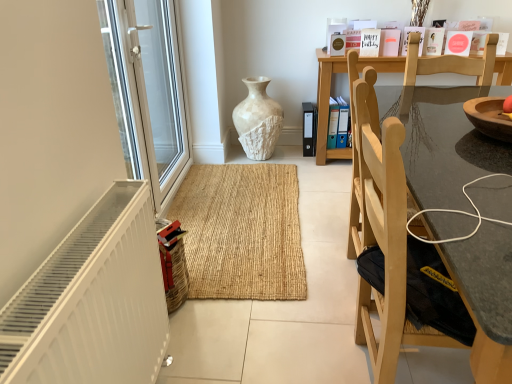
Question: Considering the positions of point (384, 172) and point (240, 125), is point (384, 172) closer or farther from the camera than point (240, 125)?

Choices:
 (A) farther
 (B) closer

Answer: (B)

Question: In the image, is light wood chair at right on the left side or the right side of white textured vase at center?

Choices:
 (A) left
 (B) right

Answer: (B)

Question: Which of these objects is positioned farthest from the white matte radiator at lower left?

Choices:
 (A) white textured vase at center
 (B) light wood chair at right
 (C) white glossy screen door at left

Answer: (A)

Question: Considering the real-world distances, which object is closest to the white textured vase at center?

Choices:
 (A) white matte radiator at lower left
 (B) white glossy screen door at left
 (C) light wood chair at right

Answer: (B)